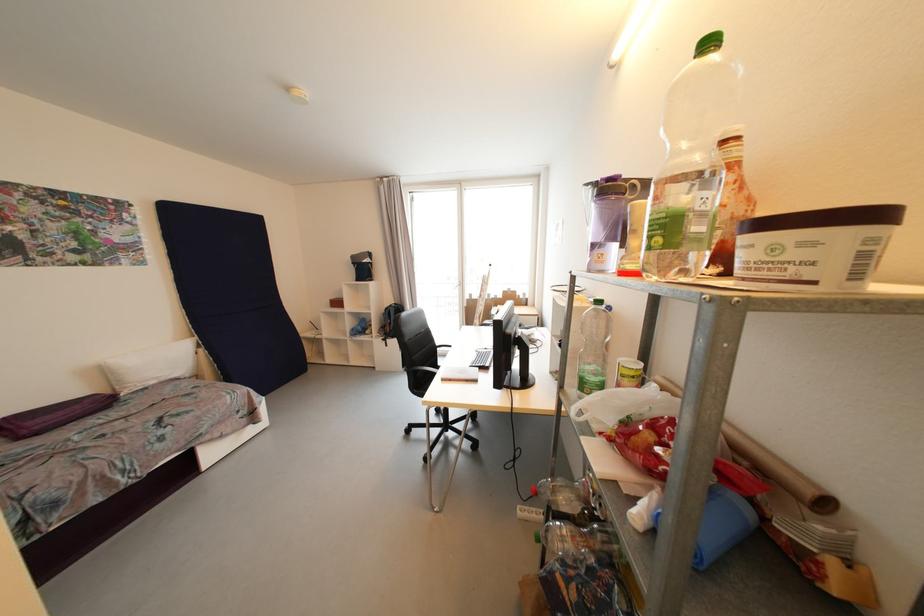
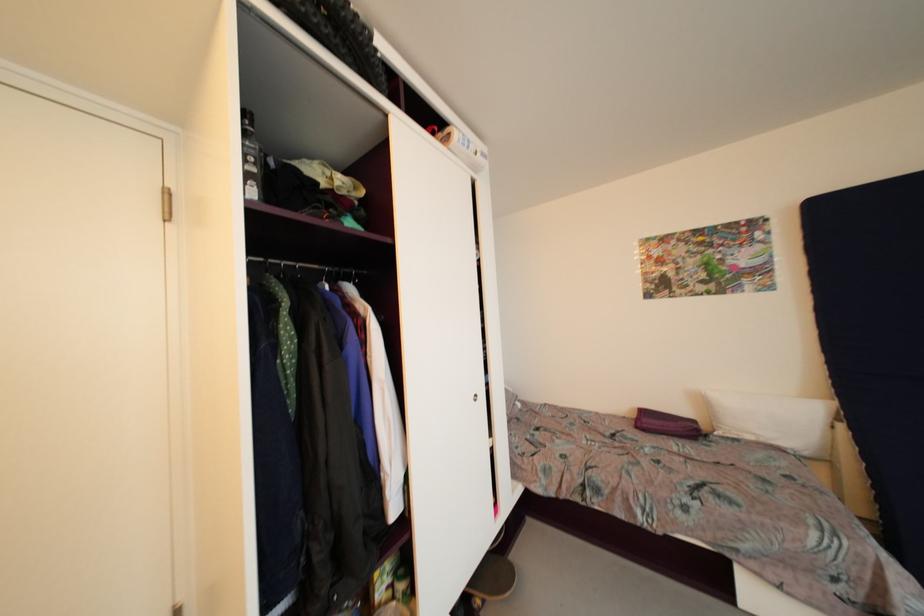
In the second image, find the point that corresponds to (x=191, y=378) in the first image.

(810, 456)